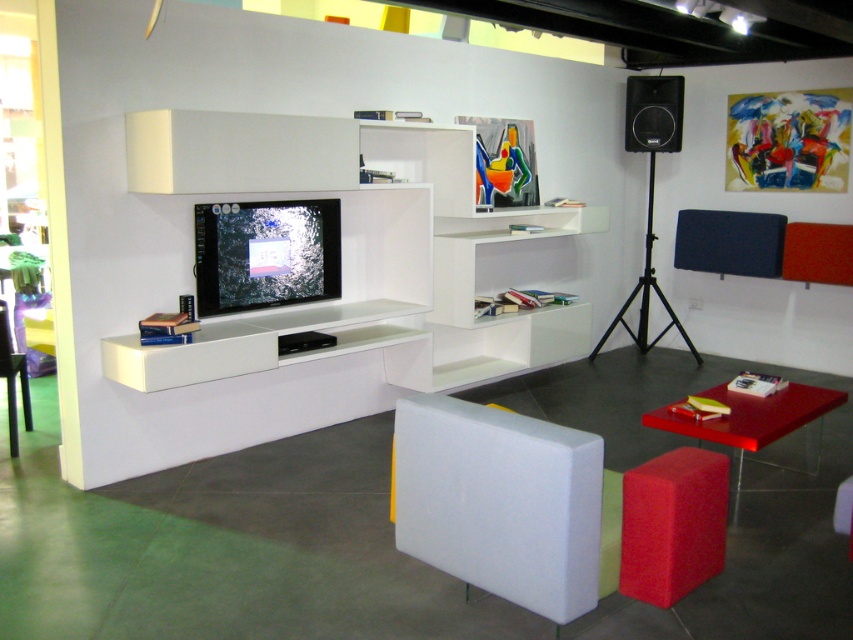
From the picture: You are arranging a small party and need to place a 1.2 meter long banner between the rubberized red stool at lower right and the black matte speaker at upper right. Can the banner fit horizontally between them?

The rubberized red stool at lower right is bigger than the black matte speaker at upper right, but the banner requires horizontal space between them. However, the description does not provide information about the distance between the two objects, so it is impossible to determine if the banner can fit horizontally.

You are planning to place a new coffee table in the living room. The white foam chair at center and the rubberized red stool at lower right are both in the way. Which object should you move first to create space for the table?

You should move the white foam chair at center first since it might be wider than the rubberized red stool at lower right, requiring more space to clear the area for the coffee table.